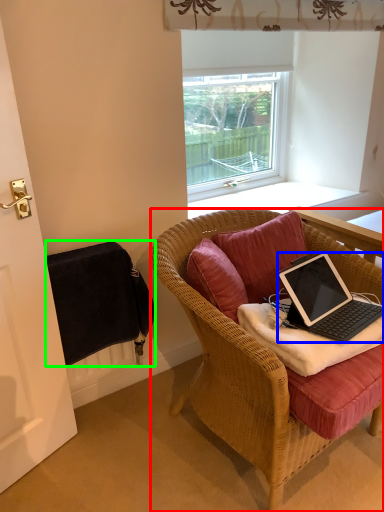
Question: Which is farther away from chair (highlighted by a red box)? laptop (highlighted by a blue box) or radiator (highlighted by a green box)?

Choices:
 (A) laptop
 (B) radiator

Answer: (B)